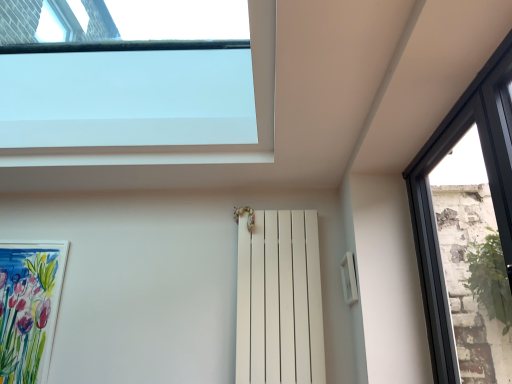
Describe the element at coordinates (279, 300) in the screenshot. I see `white matte radiator at center` at that location.

In order to face white matte radiator at center, should I rotate leftwards or rightwards?

Turn right by 3.483 degrees to look at white matte radiator at center.

Locate an element on the screen. Image resolution: width=512 pixels, height=384 pixels. watercolor paper picture frame at lower left is located at coordinates (29, 307).

From the image's perspective, which one is positioned higher, transparent glass window at upper center, which is counted as the 1th window, starting from the left, or white matte radiator at center?

transparent glass window at upper center, which is counted as the 1th window, starting from the left, appears higher in the image.

Is white matte radiator at center a part of transparent glass window at upper center, the second window in the right-to-left sequence?

Definitely not — white matte radiator at center is not inside transparent glass window at upper center, the second window in the right-to-left sequence.

Considering the positions of objects transparent glass window at upper center, the second window in the right-to-left sequence, and white matte radiator at center in the image provided, who is behind, transparent glass window at upper center, the second window in the right-to-left sequence, or white matte radiator at center?

white matte radiator at center is further from the camera.

From their relative heights in the image, would you say transparent glass window at upper center, the second window in the right-to-left sequence, is taller or shorter than white matte radiator at center?

Considering their sizes, transparent glass window at upper center, the second window in the right-to-left sequence, has less height than white matte radiator at center.

Is white matte radiator at center bigger or smaller than watercolor paper picture frame at lower left?

white matte radiator at center is bigger than watercolor paper picture frame at lower left.

Where is `shutter above the watercolor paper picture frame at lower left (from a real-world perspective)`? shutter above the watercolor paper picture frame at lower left (from a real-world perspective) is located at coordinates (279, 300).

Could you tell me if white matte radiator at center is facing watercolor paper picture frame at lower left?

Yes.

Is point (269, 363) in front of point (52, 304)?

That is True.

From the image's perspective, relative to transparent glass window at upper center, the second window in the right-to-left sequence, is white matte radiator at center above or below?

white matte radiator at center is situated lower than transparent glass window at upper center, the second window in the right-to-left sequence, in the image.

Is white matte radiator at center placed right next to transparent glass window at upper center, which is counted as the 1th window, starting from the left?

There is a gap between white matte radiator at center and transparent glass window at upper center, which is counted as the 1th window, starting from the left.

Is transparent glass window at upper center, the second window in the right-to-left sequence, surrounded by white matte radiator at center?

No, transparent glass window at upper center, the second window in the right-to-left sequence, is not surrounded by white matte radiator at center.

Considering the sizes of objects white matte radiator at center and transparent glass window at upper center, which is counted as the 1th window, starting from the left, in the image provided, who is shorter, white matte radiator at center or transparent glass window at upper center, which is counted as the 1th window, starting from the left,?

With less height is transparent glass window at upper center, which is counted as the 1th window, starting from the left.

From the image's perspective, is black glass window at right, marked as the 2th window in a left-to-right arrangement, located beneath watercolor paper picture frame at lower left?

No, from the image's perspective, black glass window at right, marked as the 2th window in a left-to-right arrangement, is not below watercolor paper picture frame at lower left.

Considering the positions of objects black glass window at right, marked as the 2th window in a left-to-right arrangement, and watercolor paper picture frame at lower left in the image provided, who is more to the left, black glass window at right, marked as the 2th window in a left-to-right arrangement, or watercolor paper picture frame at lower left?

watercolor paper picture frame at lower left is more to the left.

Is black glass window at right, which is counted as the 1th window, starting from the right, far away from watercolor paper picture frame at lower left?

Indeed, black glass window at right, which is counted as the 1th window, starting from the right, is not near watercolor paper picture frame at lower left.

Based on the photo, does black glass window at right, marked as the 2th window in a left-to-right arrangement, contain watercolor paper picture frame at lower left?

No.

Is watercolor paper picture frame at lower left oriented away from white matte radiator at center?

No.

Is watercolor paper picture frame at lower left next to white matte radiator at center?

No, watercolor paper picture frame at lower left is not next to white matte radiator at center.

Image resolution: width=512 pixels, height=384 pixels. In order to click on picture frame on the left of the white matte radiator at center in this screenshot , I will do 29,307.

From the picture: Measure the distance from watercolor paper picture frame at lower left to white matte radiator at center.

watercolor paper picture frame at lower left is 3.90 feet from white matte radiator at center.

How many degrees apart are the facing directions of black glass window at right, marked as the 2th window in a left-to-right arrangement, and transparent glass window at upper center, which is counted as the 1th window, starting from the left?

The angle between the facing direction of black glass window at right, marked as the 2th window in a left-to-right arrangement, and the facing direction of transparent glass window at upper center, which is counted as the 1th window, starting from the left, is 2.34 degrees.

From the image's perspective, would you say black glass window at right, marked as the 2th window in a left-to-right arrangement, is positioned over transparent glass window at upper center, which is counted as the 1th window, starting from the left?

Actually, black glass window at right, marked as the 2th window in a left-to-right arrangement, appears below transparent glass window at upper center, which is counted as the 1th window, starting from the left, in the image.

Is black glass window at right, which is counted as the 1th window, starting from the right, bigger than transparent glass window at upper center, the second window in the right-to-left sequence?

Yes.

From a real-world perspective, between black glass window at right, marked as the 2th window in a left-to-right arrangement, and transparent glass window at upper center, which is counted as the 1th window, starting from the left, who is vertically higher?

From a 3D spatial view, transparent glass window at upper center, which is counted as the 1th window, starting from the left, is above.

Is black glass window at right, which is counted as the 1th window, starting from the right, at the back of white matte radiator at center?

No, white matte radiator at center is not facing the opposite direction of black glass window at right, which is counted as the 1th window, starting from the right.

Based on the photo, which is more to the left, white matte radiator at center or black glass window at right, marked as the 2th window in a left-to-right arrangement?

From the viewer's perspective, white matte radiator at center appears more on the left side.

Is black glass window at right, which is counted as the 1th window, starting from the right, located within white matte radiator at center?

No.

There is a white matte radiator at center. Identify the location of the 2nd window above it (from a real-world perspective). (186, 147).

I want to click on shutter above the watercolor paper picture frame at lower left (from the image's perspective), so click(x=279, y=300).

From the picture: Which object lies further to the anchor point white matte radiator at center, black glass window at right, marked as the 2th window in a left-to-right arrangement, or watercolor paper picture frame at lower left?

The object further to white matte radiator at center is watercolor paper picture frame at lower left.

Based on their spatial positions, is transparent glass window at upper center, the second window in the right-to-left sequence, or black glass window at right, which is counted as the 1th window, starting from the right, further from watercolor paper picture frame at lower left?

black glass window at right, which is counted as the 1th window, starting from the right, is positioned further to the anchor watercolor paper picture frame at lower left.

Which object lies nearer to the anchor point white matte radiator at center, black glass window at right, marked as the 2th window in a left-to-right arrangement, or transparent glass window at upper center, which is counted as the 1th window, starting from the left?

transparent glass window at upper center, which is counted as the 1th window, starting from the left, is positioned closer to the anchor white matte radiator at center.

Based on their spatial positions, is white matte radiator at center or transparent glass window at upper center, which is counted as the 1th window, starting from the left, further from watercolor paper picture frame at lower left?

white matte radiator at center.

Based on their spatial positions, is transparent glass window at upper center, which is counted as the 1th window, starting from the left, or white matte radiator at center further from black glass window at right, which is counted as the 1th window, starting from the right?

transparent glass window at upper center, which is counted as the 1th window, starting from the left, is positioned further to the anchor black glass window at right, which is counted as the 1th window, starting from the right.

Considering their positions, is white matte radiator at center positioned closer to transparent glass window at upper center, which is counted as the 1th window, starting from the left, than watercolor paper picture frame at lower left?

white matte radiator at center is positioned closer to the anchor transparent glass window at upper center, which is counted as the 1th window, starting from the left.

When comparing their distances from white matte radiator at center, does transparent glass window at upper center, which is counted as the 1th window, starting from the left, or watercolor paper picture frame at lower left seem further?

watercolor paper picture frame at lower left.

From the image, which object appears to be nearer to transparent glass window at upper center, which is counted as the 1th window, starting from the left, white matte radiator at center or black glass window at right, which is counted as the 1th window, starting from the right?

white matte radiator at center.

What are the coordinates of `window between watercolor paper picture frame at lower left and black glass window at right, which is counted as the 1th window, starting from the right, from left to right` in the screenshot? It's located at (186, 147).

The image size is (512, 384). Identify the location of shutter between transparent glass window at upper center, the second window in the right-to-left sequence, and black glass window at right, marked as the 2th window in a left-to-right arrangement. (279, 300).

At what (x,y) coordinates should I click in order to perform the action: click on window between watercolor paper picture frame at lower left and white matte radiator at center. Please return your answer as a coordinate pair (x, y). Looking at the image, I should click on (186, 147).

The width and height of the screenshot is (512, 384). Identify the location of shutter between watercolor paper picture frame at lower left and black glass window at right, which is counted as the 1th window, starting from the right. (279, 300).